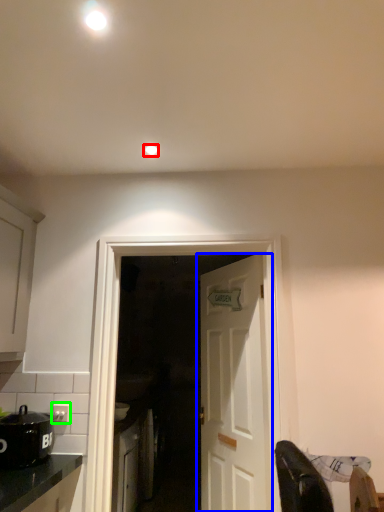
Question: Estimate the real-world distances between objects in this image. Which object is farther from lighting (highlighted by a red box), door (highlighted by a blue box) or electric outlet (highlighted by a green box)?

Choices:
 (A) door
 (B) electric outlet

Answer: (A)